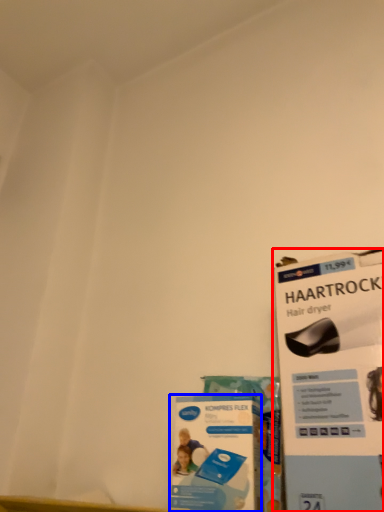
Question: Which point is closer to the camera, magazine (highlighted by a red box) or flyer (highlighted by a blue box)?

Choices:
 (A) magazine
 (B) flyer

Answer: (A)